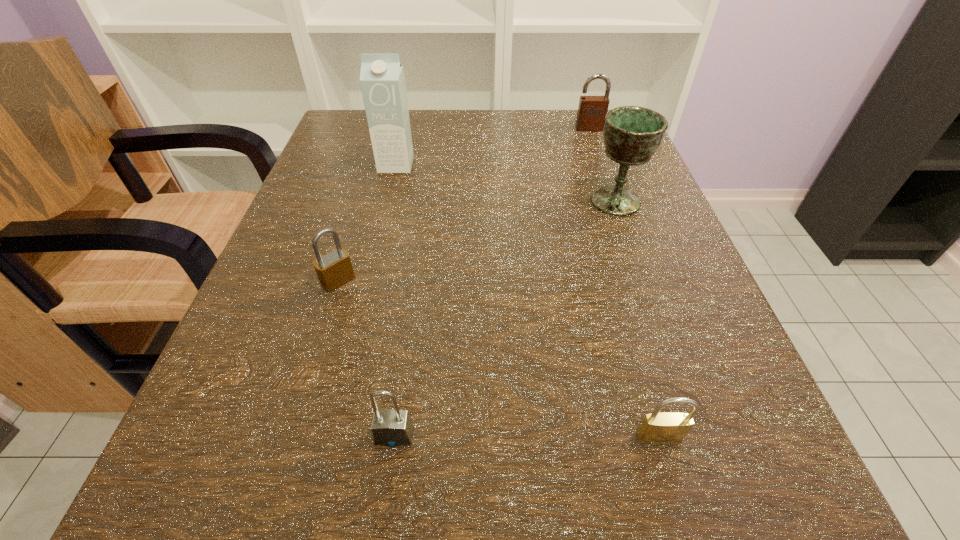
Where is `vacant space located 0.360m on the front of the chalice`? The width and height of the screenshot is (960, 540). vacant space located 0.360m on the front of the chalice is located at coordinates (691, 413).

Identify the location of blank space located on the front-facing side of the tallest padlock. The height and width of the screenshot is (540, 960). (606, 175).

Identify the location of free space located 0.180m on the right of the third nearest padlock. The image size is (960, 540). (477, 281).

Locate an element on the screen. The width and height of the screenshot is (960, 540). carton situated at the far edge is located at coordinates (382, 80).

Locate an element on the screen. This screenshot has width=960, height=540. padlock at the far edge is located at coordinates (592, 110).

Identify the location of carton present at the left edge. The width and height of the screenshot is (960, 540). (382, 80).

You are a GUI agent. You are given a task and a screenshot of the screen. Output one action in this format:
    pyautogui.click(x=<x>, y=<y>)
    Task: Click on the padlock present at the left edge
    
    Given the screenshot: What is the action you would take?
    pyautogui.click(x=333, y=269)

This screenshot has width=960, height=540. What are the coordinates of `chalice that is positioned at the right edge` in the screenshot? It's located at (632, 134).

Image resolution: width=960 pixels, height=540 pixels. Find the location of `object positioned at the far left corner`. object positioned at the far left corner is located at coordinates (382, 80).

This screenshot has width=960, height=540. Identify the location of object present at the far right corner. (592, 110).